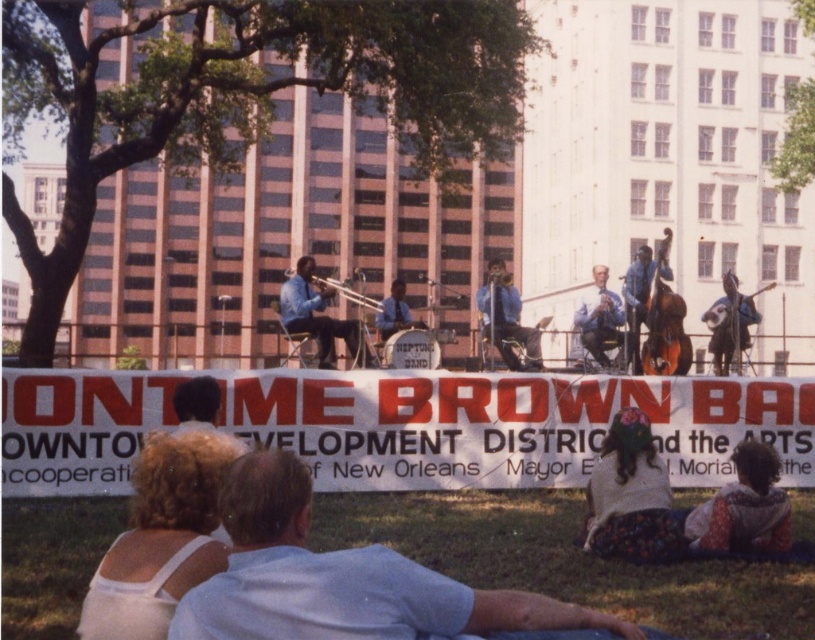
Question: Is floral fabric dress at lower right positioned in front of matte blue trumpet at center?

Choices:
 (A) no
 (B) yes

Answer: (B)

Question: Considering the relative positions of matte blue trumpet at center and matte blue saxophone at center in the image provided, where is matte blue trumpet at center located with respect to matte blue saxophone at center?

Choices:
 (A) left
 (B) right

Answer: (A)

Question: Can you confirm if white cotton shirt at lower center is positioned to the left of floral fabric dress at lower right?

Choices:
 (A) yes
 (B) no

Answer: (A)

Question: Based on their relative distances, which object is farther from the floral-patterned shirt at lower right?

Choices:
 (A) shiny blue trumpet at center
 (B) matte blue saxophone at center
 (C) floral fabric dress at lower right
 (D) shiny black bass at center

Answer: (A)

Question: Which point is farther from the camera taking this photo?

Choices:
 (A) (x=294, y=314)
 (B) (x=749, y=472)

Answer: (A)

Question: Which of the following is the closest to the observer?

Choices:
 (A) (598, 460)
 (B) (756, 493)
 (C) (280, 310)

Answer: (B)